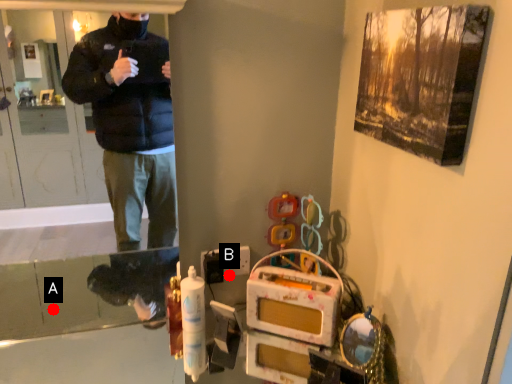
Question: Two points are circled on the image, labeled by A and B beside each circle. Which point is closer to the camera?

Choices:
 (A) A is closer
 (B) B is closer

Answer: (B)